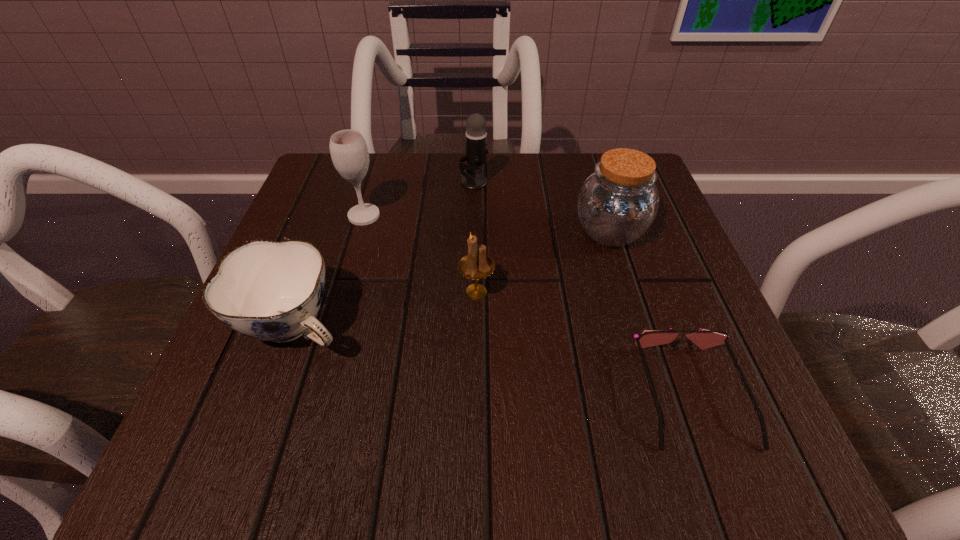
This screenshot has height=540, width=960. In order to click on wineglass in this screenshot , I will do `click(349, 153)`.

Locate an element on the screen. This screenshot has width=960, height=540. the farthest object is located at coordinates (476, 136).

Find the location of a particular element. This screenshot has width=960, height=540. jar is located at coordinates (617, 204).

What are the coordinates of `candle holder` in the screenshot? It's located at (476, 265).

This screenshot has width=960, height=540. Identify the location of chinaware. (271, 291).

Locate an element on the screen. The width and height of the screenshot is (960, 540). the shortest object is located at coordinates (704, 339).

The height and width of the screenshot is (540, 960). In order to click on vacant space located on the right of the wineglass in this screenshot , I will do `click(562, 216)`.

Find the location of `vacant space located 0.240m on the right of the farthest object`. vacant space located 0.240m on the right of the farthest object is located at coordinates (599, 181).

Where is `vacant space positioned 0.140m on the front of the jar`? This screenshot has height=540, width=960. vacant space positioned 0.140m on the front of the jar is located at coordinates pyautogui.click(x=637, y=319).

At what (x,y) coordinates should I click in order to perform the action: click on free location located on the front of the candle holder. Please return your answer as a coordinate pair (x, y). This screenshot has height=540, width=960. Looking at the image, I should click on (476, 388).